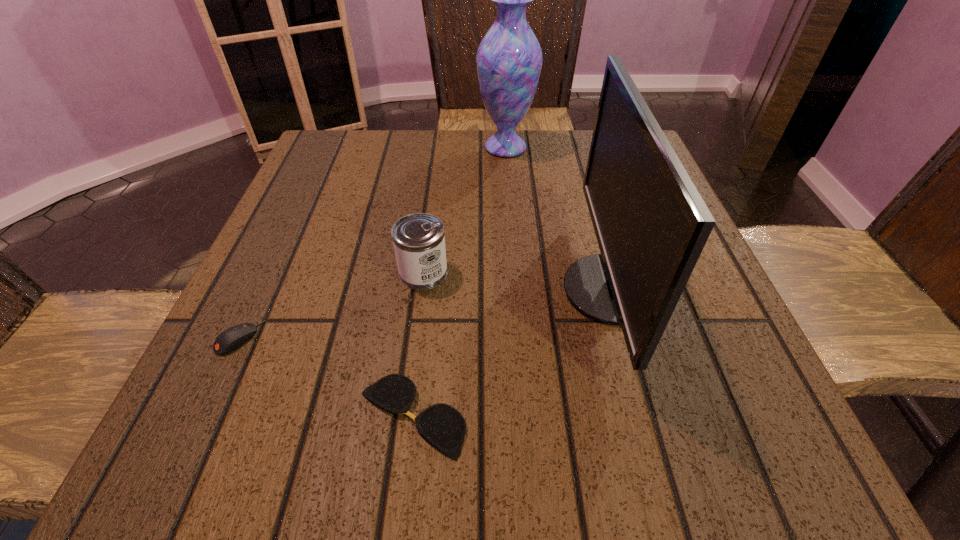
This screenshot has width=960, height=540. What are the coordinates of `vase` in the screenshot? It's located at (509, 58).

Locate an element on the screen. This screenshot has height=540, width=960. the second object from right to left is located at coordinates (509, 58).

Locate an element on the screen. monitor is located at coordinates (651, 224).

Find the location of a particular element. can is located at coordinates (419, 242).

Identify the location of computer mouse. (229, 340).

Where is `the second shortest object`? the second shortest object is located at coordinates (229, 340).

Identify the location of spectacles. (442, 425).

Locate an element on the screen. vacant space situated on the left of the second object from right to left is located at coordinates (360, 147).

This screenshot has height=540, width=960. Find the location of `blank area located 0.270m on the screen side of the monitor`. blank area located 0.270m on the screen side of the monitor is located at coordinates (402, 290).

You are a GUI agent. You are given a task and a screenshot of the screen. Output one action in this format:
    pyautogui.click(x=<x>, y=<y>)
    Task: Click on the vacant space located on the screen side of the monitor
    The height and width of the screenshot is (540, 960).
    Given the screenshot: What is the action you would take?
    pyautogui.click(x=361, y=290)